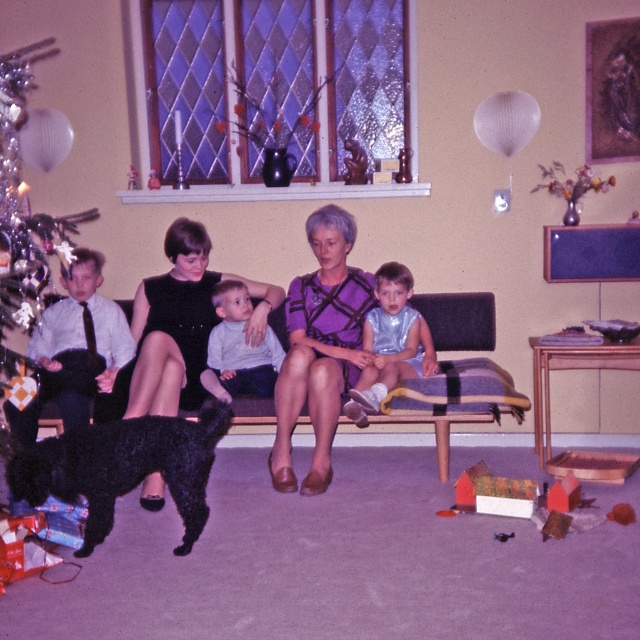
You are standing in the room and want to place a small decoration on the point closer to you. Which point should you choose between point (147, 358) and point (164, 346)?

Point (147, 358) is closer to the camera, so you should choose point (147, 358) to place the decoration.

You are a photographer standing in the room and want to take a photo of the matte purple dress at center and the shiny silver outfit at center. The camera you are using has a minimum focus distance of 35 inches. Will you be able to capture both subjects clearly in the same frame without moving closer?

The distance between the matte purple dress at center and the shiny silver outfit at center is 34.67 inches. Since the camera requires a minimum focus distance of 35 inches, you are slightly too close to capture both subjects clearly in the same frame without moving back.